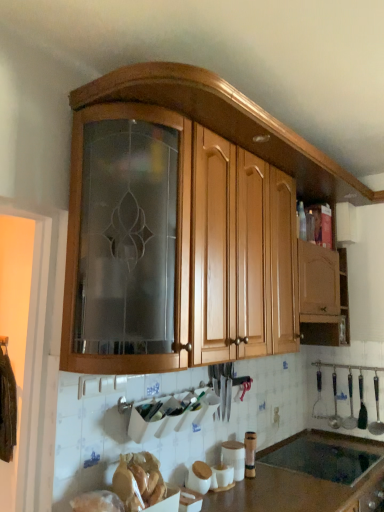
This screenshot has height=512, width=384. Identify the location of vacant area that is in front of metallic silver spoon at lower right, marked as the 1th silverware in a left-to-right arrangement. [x=358, y=441].